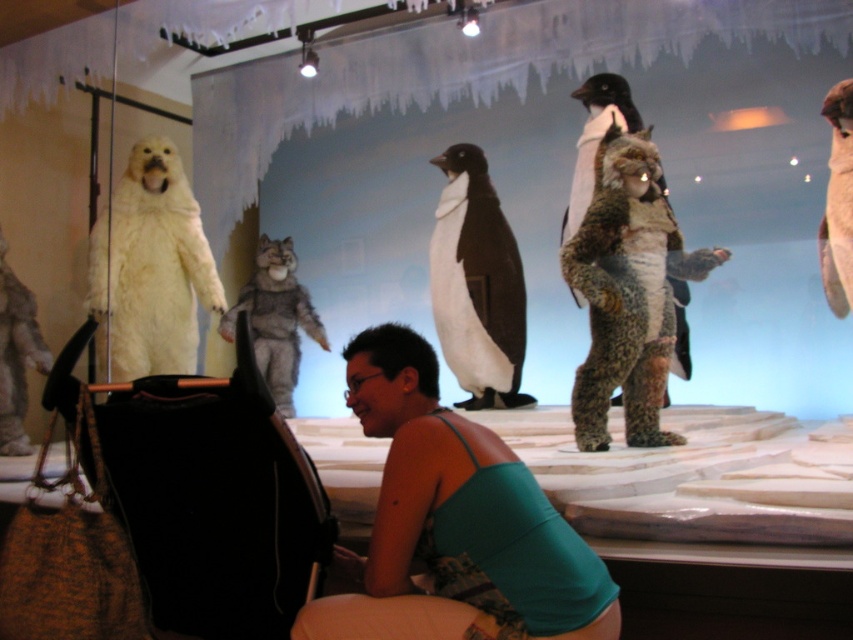
Can you confirm if black matte penguin at center is positioned below gray furry wolf at center?

No.

Which is below, black matte penguin at center or gray furry wolf at center?

gray furry wolf at center is lower down.

Who is more distant from viewer, (509, 385) or (287, 385)?

The point (287, 385) is more distant.

Where is `black matte penguin at center`? This screenshot has height=640, width=853. black matte penguin at center is located at coordinates (476, 284).

Does teal fabric tank top at center have a lesser height compared to white fluffy penguin at upper right?

Yes.

Does teal fabric tank top at center have a larger size compared to white fluffy penguin at upper right?

No.

You are a GUI agent. You are given a task and a screenshot of the screen. Output one action in this format:
    pyautogui.click(x=<x>, y=<y>)
    Task: Click on the teal fabric tank top at center
    
    Given the screenshot: What is the action you would take?
    pyautogui.click(x=454, y=522)

Locate an element on the screen. Image resolution: width=853 pixels, height=640 pixels. teal fabric tank top at center is located at coordinates (454, 522).

Which of these two, teal fabric tank top at center or black matte penguin at center, stands shorter?

Standing shorter between the two is teal fabric tank top at center.

Where is `teal fabric tank top at center`? teal fabric tank top at center is located at coordinates pos(454,522).

At what (x,y) coordinates should I click in order to perform the action: click on teal fabric tank top at center. Please return your answer as a coordinate pair (x, y). The image size is (853, 640). Looking at the image, I should click on (454, 522).